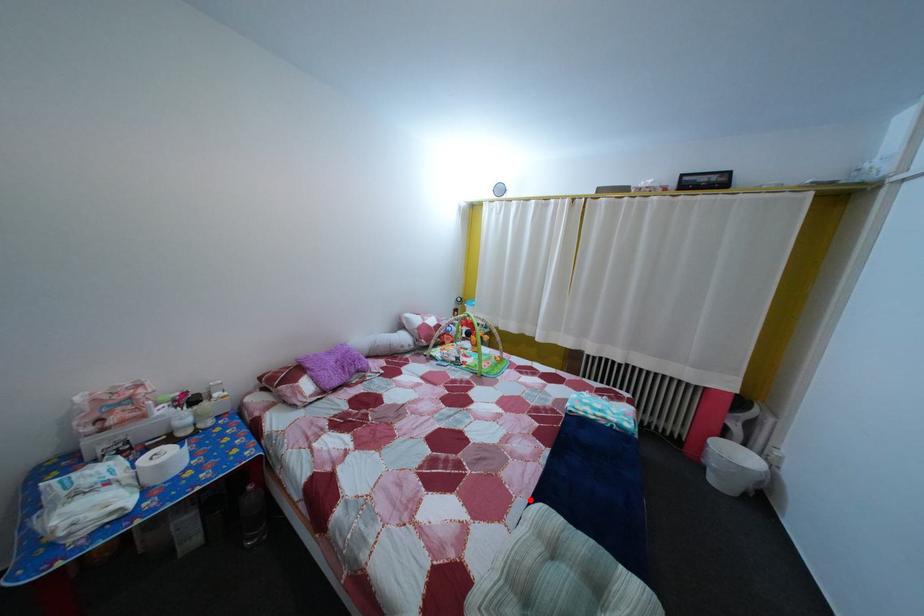
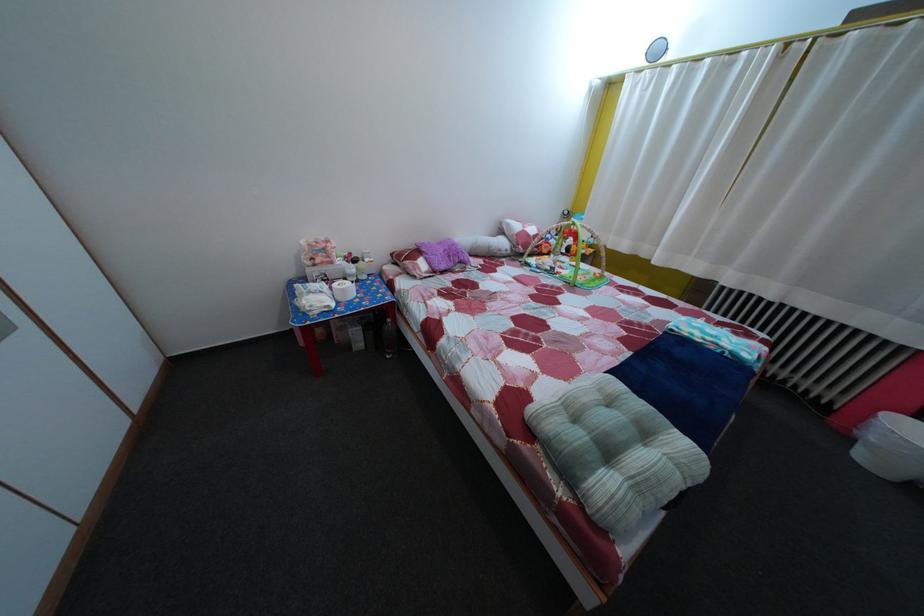
Where in the second image is the point corresponding to the highlighted location from the first image?

(601, 379)